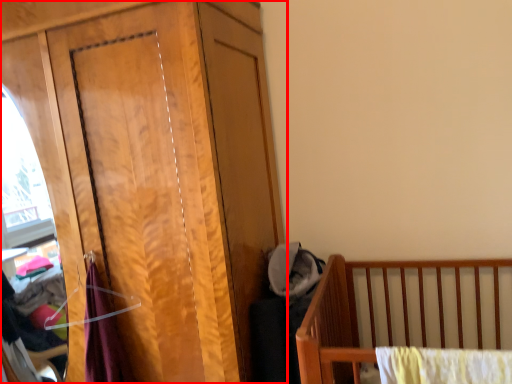
Question: From the image's perspective, what is the correct spatial positioning of dresser (annotated by the red box) in reference to baby clothe?

Choices:
 (A) below
 (B) above

Answer: (B)